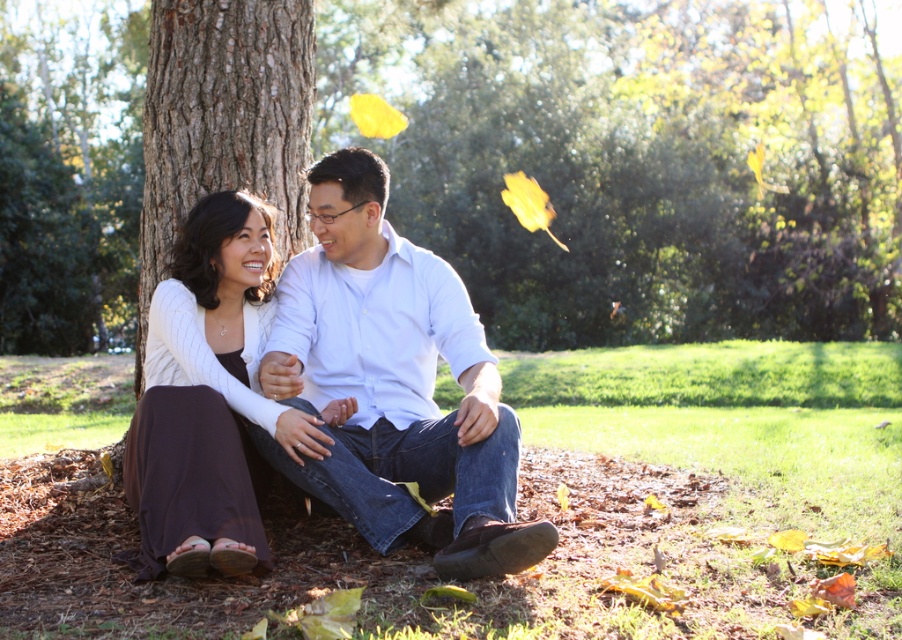
You are standing in the park and see the matte white sweater at center and the brown textured bark at center. Which object is nearer to you?

The matte white sweater at center is closer to the viewer than the brown textured bark at center, so the matte white sweater at center is nearer to you.

Looking at this image, you are a photographer trying to capture a closeup of the brown textured bark at center. However, the brown denim jeans at center are blocking your view. Can you tell me which object is larger so I know which one to move?

The brown denim jeans at center is bigger than brown textured bark at center, so you should move the brown denim jeans at center to get a clear view of the brown textured bark at center.